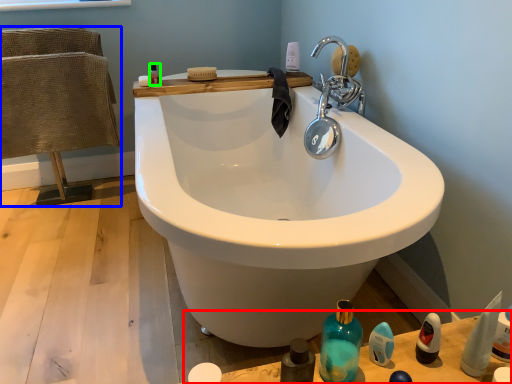
Question: Which object is the closest to the counter top (highlighted by a red box)? Choose among these: chair (highlighted by a blue box) or mouthwash (highlighted by a green box).

Choices:
 (A) chair
 (B) mouthwash

Answer: (B)